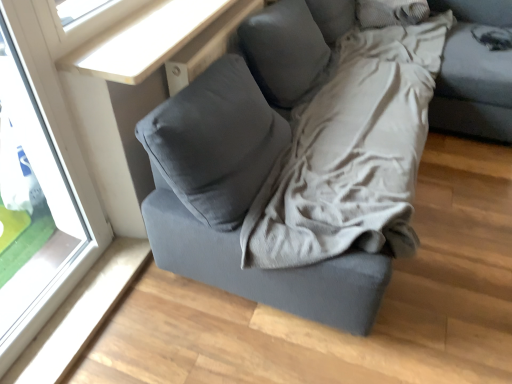
Question: Visually, is transparent glass window at upper left positioned to the left or to the right of gray fabric pillow at upper right?

Choices:
 (A) left
 (B) right

Answer: (A)

Question: Looking at their shapes, would you say transparent glass window at upper left is wider or thinner than gray fabric pillow at upper right?

Choices:
 (A) wide
 (B) thin

Answer: (B)

Question: From their relative heights in the image, would you say transparent glass window at upper left is taller or shorter than gray fabric pillow at upper right?

Choices:
 (A) tall
 (B) short

Answer: (A)

Question: Is gray fabric pillow at upper right bigger or smaller than transparent glass window at upper left?

Choices:
 (A) small
 (B) big

Answer: (A)

Question: Is point (384, 11) closer or farther from the camera than point (59, 231)?

Choices:
 (A) closer
 (B) farther

Answer: (B)

Question: From the image's perspective, is gray fabric pillow at upper right above or below transparent glass window at upper left?

Choices:
 (A) below
 (B) above

Answer: (B)

Question: From their relative heights in the image, would you say gray fabric pillow at upper right is taller or shorter than transparent glass window at upper left?

Choices:
 (A) short
 (B) tall

Answer: (A)